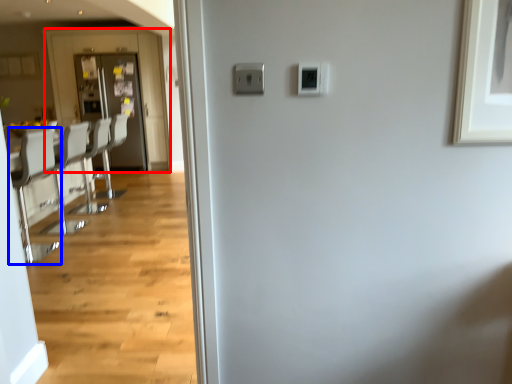
Question: Which point is further to the camera, screen door (highlighted by a red box) or chair (highlighted by a blue box)?

Choices:
 (A) screen door
 (B) chair

Answer: (A)